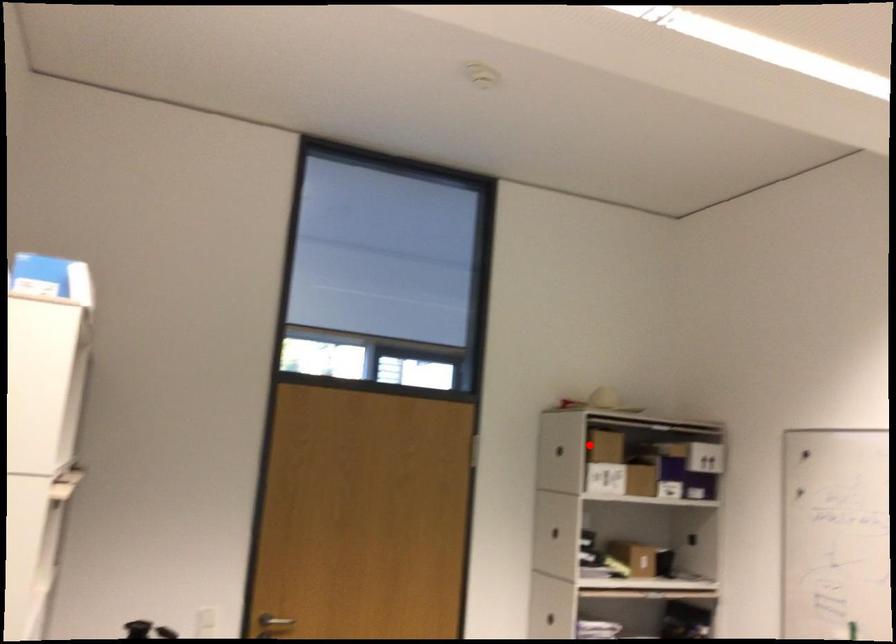
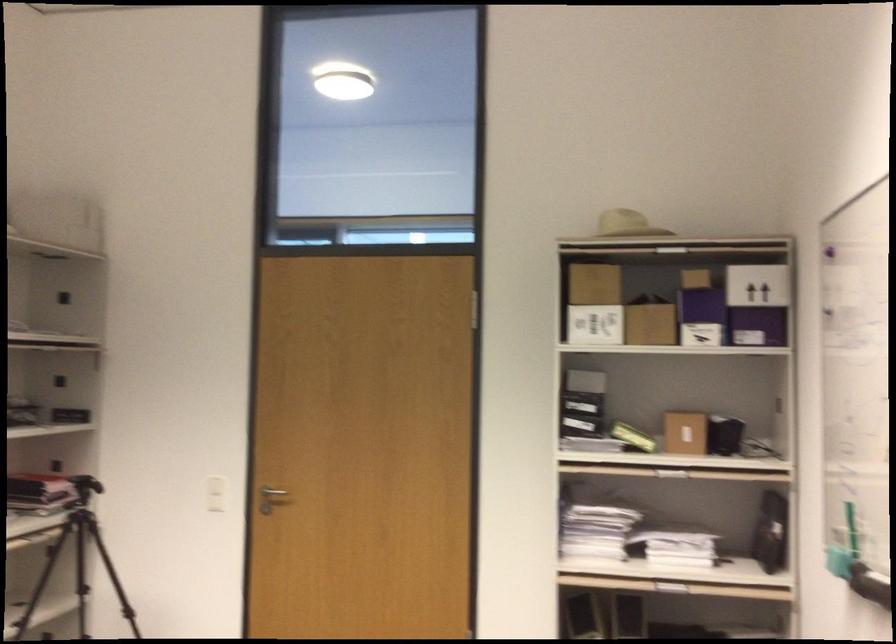
Question: I am providing you with two images of the same scene from different viewpoints. A red point is shown in image1. For the corresponding object point in image2, is it positioned nearer or farther from the camera?

Choices:
 (A) Nearer
 (B) Farther

Answer: (A)